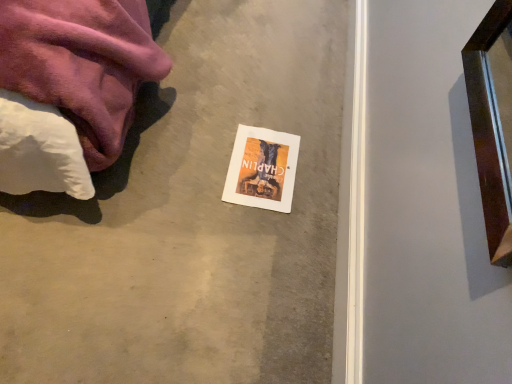
Question: Is orange matte paper flyer at center inside or outside of smooth concrete at center?

Choices:
 (A) inside
 (B) outside

Answer: (A)

Question: Is point (290, 182) closer or farther from the camera than point (51, 223)?

Choices:
 (A) closer
 (B) farther

Answer: (B)

Question: Considering the relative positions of orange matte paper flyer at center and smooth concrete at center in the image provided, is orange matte paper flyer at center to the left or to the right of smooth concrete at center?

Choices:
 (A) right
 (B) left

Answer: (A)

Question: From their relative heights in the image, would you say smooth concrete at center is taller or shorter than orange matte paper flyer at center?

Choices:
 (A) short
 (B) tall

Answer: (B)

Question: Is point (317, 122) closer or farther from the camera than point (283, 155)?

Choices:
 (A) closer
 (B) farther

Answer: (B)

Question: Would you say smooth concrete at center is inside or outside orange matte paper flyer at center?

Choices:
 (A) inside
 (B) outside

Answer: (B)

Question: From a real-world perspective, relative to orange matte paper flyer at center, is smooth concrete at center vertically above or below?

Choices:
 (A) below
 (B) above

Answer: (A)